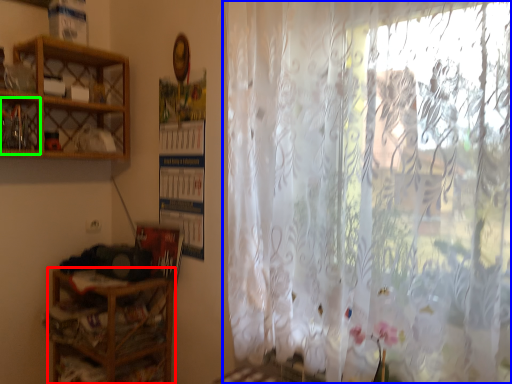
Question: Which object is positioned closest to shelf (highlighted by a red box)? Select from curtain (highlighted by a blue box) and cabinet (highlighted by a green box).

Choices:
 (A) curtain
 (B) cabinet

Answer: (B)